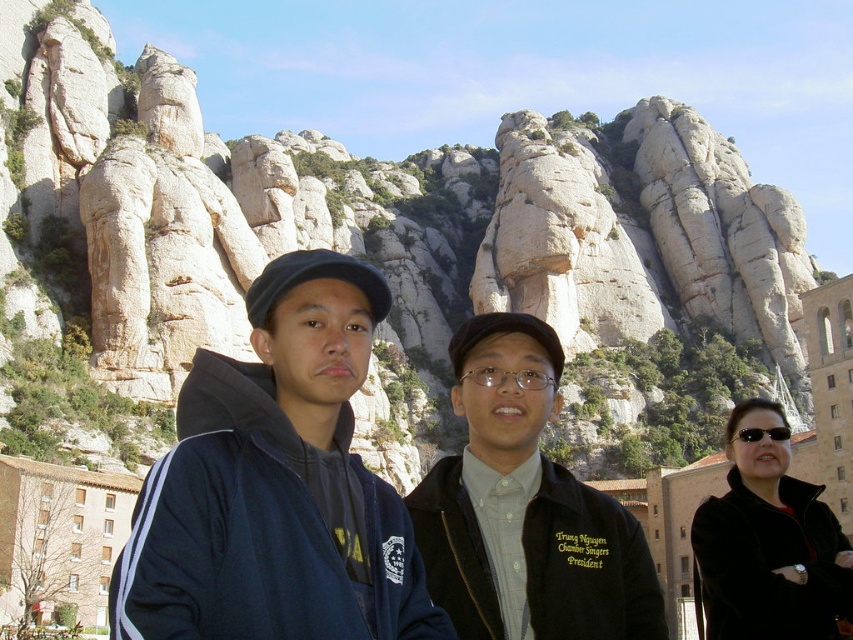
Question: Which object is positioned farthest from the dark blue jacket at center?

Choices:
 (A) dark blue fabric jacket at center
 (B) black matte jacket at center
 (C) black plastic sunglasses at center
 (D) black leather jacket at lower right

Answer: (C)

Question: Is black matte jacket at center to the left of black leather jacket at lower right from the viewer's perspective?

Choices:
 (A) yes
 (B) no

Answer: (A)

Question: Can you confirm if dark blue fabric jacket at center is positioned above black matte jacket at center?

Choices:
 (A) no
 (B) yes

Answer: (B)

Question: Which of the following is the closest to the observer?

Choices:
 (A) black leather jacket at lower right
 (B) dark blue fabric jacket at center
 (C) black plastic sunglasses at center
 (D) black matte jacket at center

Answer: (B)

Question: Does dark blue jacket at center have a lesser width compared to black leather jacket at lower right?

Choices:
 (A) no
 (B) yes

Answer: (A)

Question: Which point appears closest to the camera in this image?

Choices:
 (A) (767, 429)
 (B) (729, 561)
 (C) (294, 365)

Answer: (C)